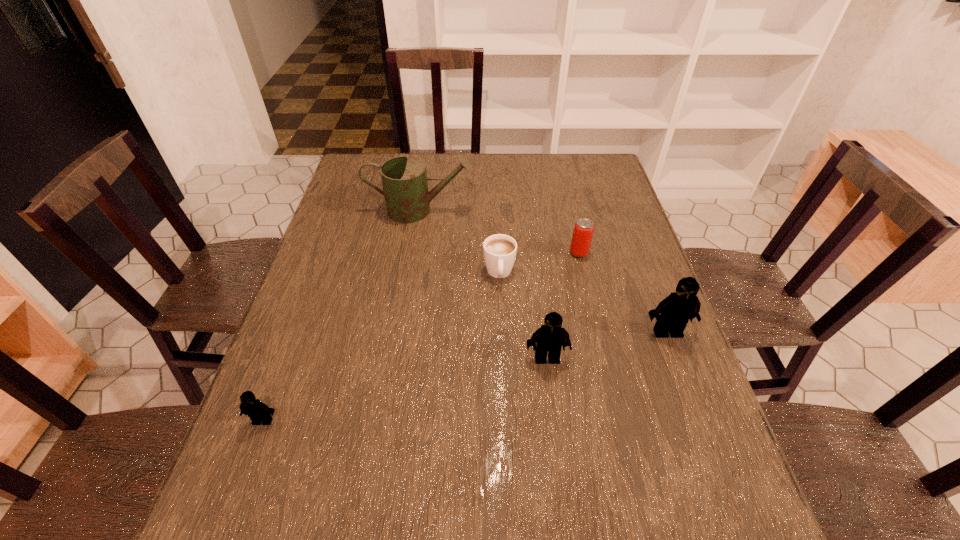
Image resolution: width=960 pixels, height=540 pixels. I want to click on vacant space at the far edge of the desktop, so click(x=461, y=178).

Where is `free space at the near edge of the desktop`? free space at the near edge of the desktop is located at coordinates (350, 472).

The image size is (960, 540). In the image, there is a desktop. In order to click on vacant space at the left edge in this screenshot , I will do pyautogui.click(x=342, y=307).

Locate an element on the screen. vacant position at the right edge of the desktop is located at coordinates (641, 313).

Find the location of a particular element. vacant area that lies between the leftmost Lego and the beer can is located at coordinates (421, 336).

What are the coordinates of `unoccupied position between the second nearest Lego and the farthest Lego` in the screenshot? It's located at (607, 345).

At what (x,y) coordinates should I click in order to perform the action: click on free space between the cappuccino and the fifth object from left to right. Please return your answer as a coordinate pair (x, y). The width and height of the screenshot is (960, 540). Looking at the image, I should click on (540, 263).

Locate an element on the screen. empty space that is in between the watering can and the farthest Lego is located at coordinates (544, 271).

Image resolution: width=960 pixels, height=540 pixels. I want to click on blank region between the nearest Lego and the second object from right to left, so click(x=421, y=336).

This screenshot has width=960, height=540. What are the coordinates of `vacant space that is in between the leftmost Lego and the cappuccino` in the screenshot? It's located at pyautogui.click(x=381, y=347).